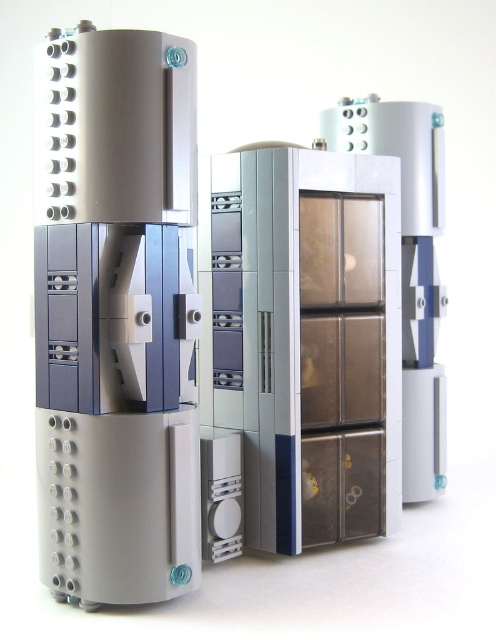
Between point (253, 292) and point (432, 323), which one is positioned in front?

Point (253, 292) is in front.

Who is shorter, translucent plastic file cabinet at center or translucent plastic drawer at center?

Standing shorter between the two is translucent plastic file cabinet at center.

Is point (384, 202) positioned in front of point (417, 387)?

Yes, it is.

This screenshot has width=496, height=640. Identify the location of translucent plastic file cabinet at center. (306, 339).

Can you confirm if matte gray tower at left is wider than translucent plastic drawer at center?

Yes, matte gray tower at left is wider than translucent plastic drawer at center.

Who is higher up, matte gray tower at left or translucent plastic drawer at center?

Positioned higher is translucent plastic drawer at center.

This screenshot has height=640, width=496. What do you see at coordinates (116, 316) in the screenshot?
I see `matte gray tower at left` at bounding box center [116, 316].

Locate an element on the screen. matte gray tower at left is located at coordinates (116, 316).

Consider the image. Is matte gray tower at left bigger than translucent plastic file cabinet at center?

No.

Does matte gray tower at left come behind translucent plastic file cabinet at center?

No, matte gray tower at left is in front of translucent plastic file cabinet at center.

The height and width of the screenshot is (640, 496). Describe the element at coordinates (116, 316) in the screenshot. I see `matte gray tower at left` at that location.

Find the location of `matte gray tower at left`. matte gray tower at left is located at coordinates (116, 316).